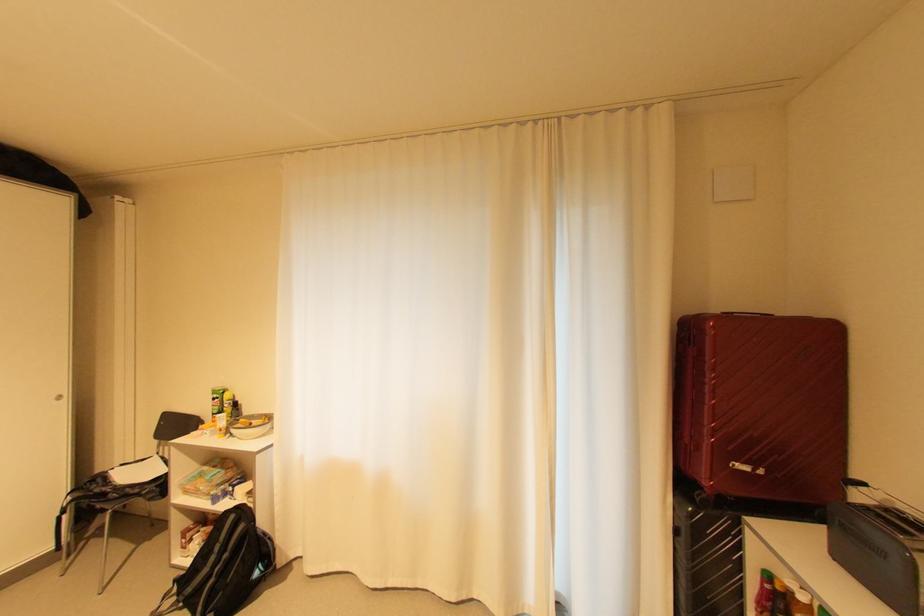
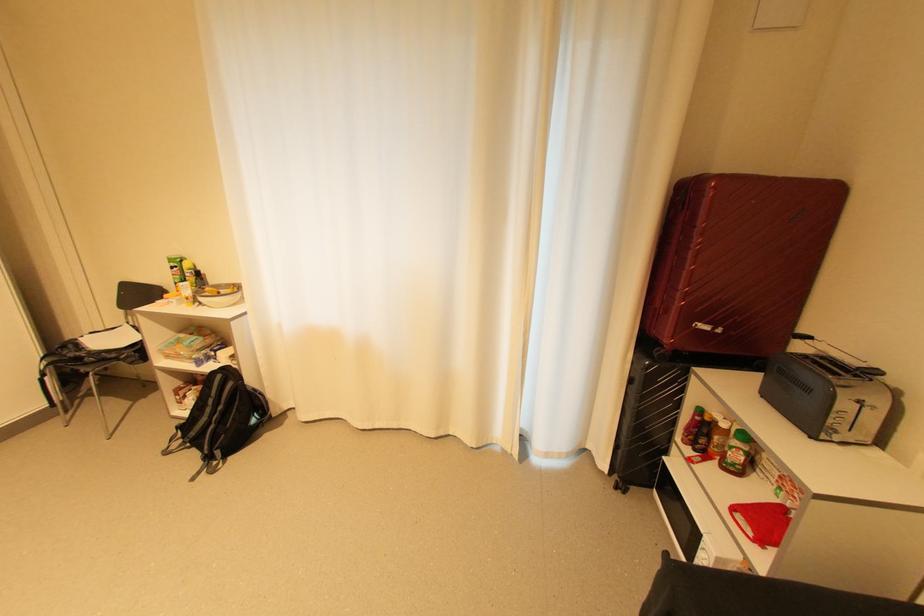
In the second image, find the point that corresponds to point (229, 427) in the first image.

(196, 296)